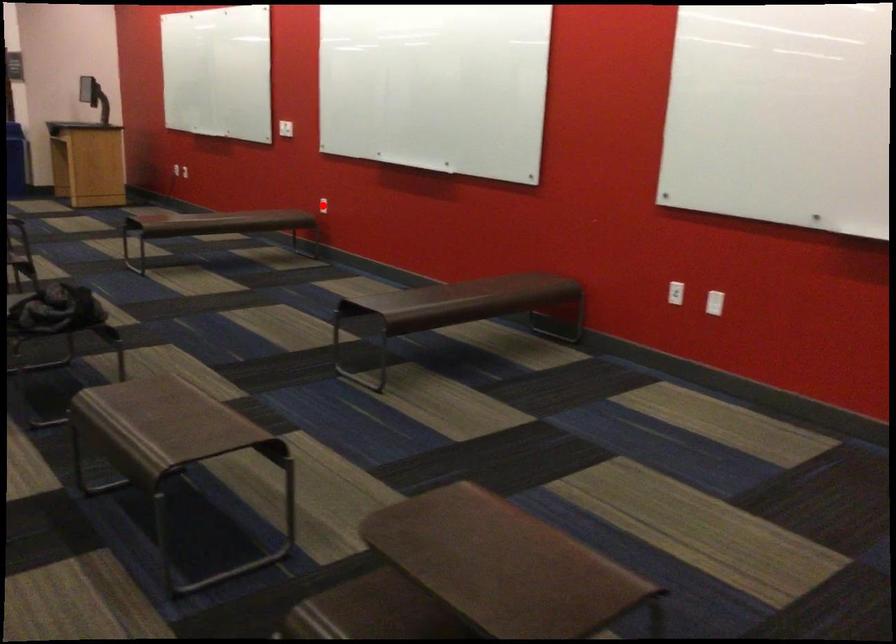
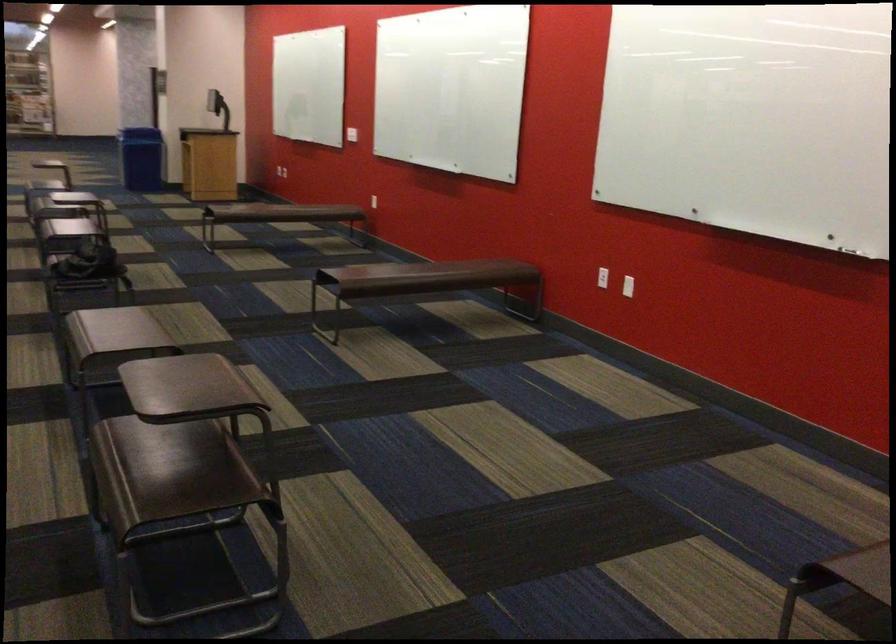
The point at the highlighted location is marked in the first image. Where is the corresponding point in the second image?

(381, 199)